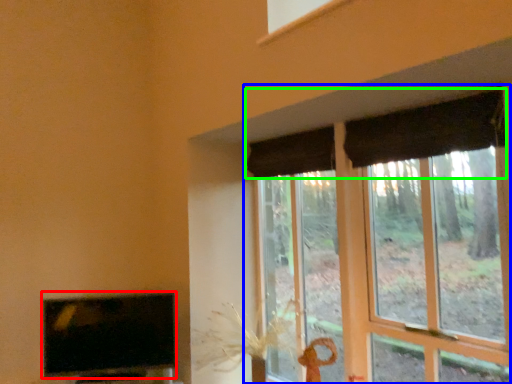
Question: Which object is positioned farthest from television (highlighted by a red box)? Select from window (highlighted by a blue box) and curtain (highlighted by a green box).

Choices:
 (A) window
 (B) curtain

Answer: (A)